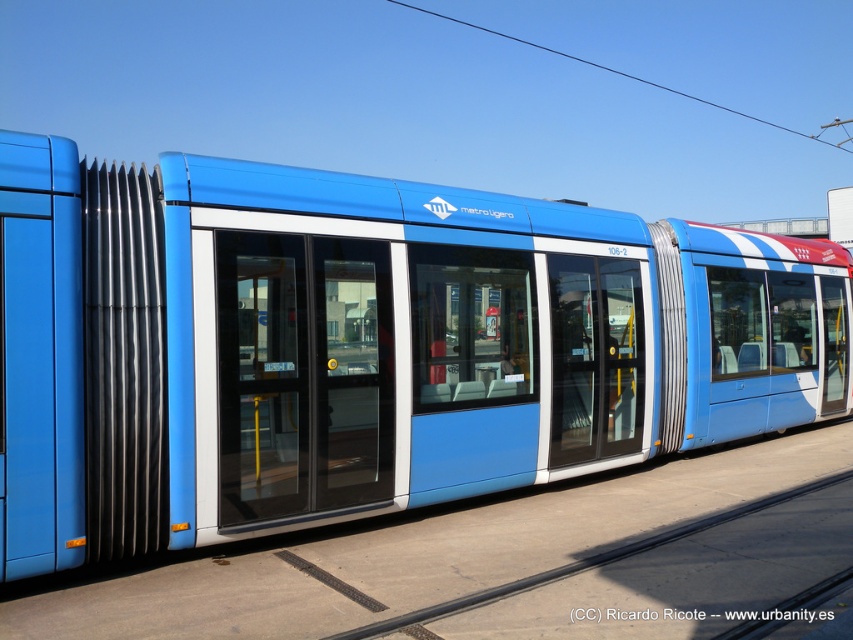
Identify the location of matte blue train at center. The height and width of the screenshot is (640, 853). (363, 346).

Is matte blue train at center shorter than black rubber train track at center?

Incorrect, matte blue train at center's height does not fall short of black rubber train track at center's.

Who is more distant from viewer, (567, 412) or (440, 614)?

Positioned behind is point (567, 412).

Where is `matte blue train at center`? matte blue train at center is located at coordinates (363, 346).